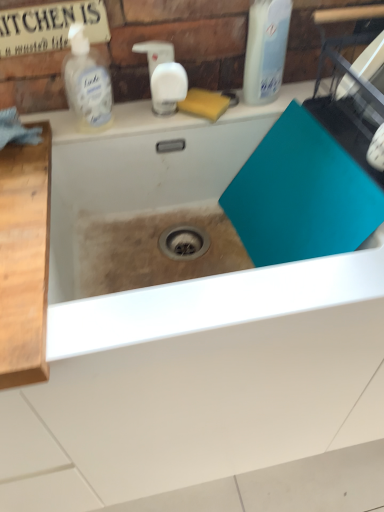
Find the location of a particular element. The width and height of the screenshot is (384, 512). vacant space to the right of clear plastic bottle at upper left, positioned as the first cleaning product in left-to-right order is located at coordinates (153, 118).